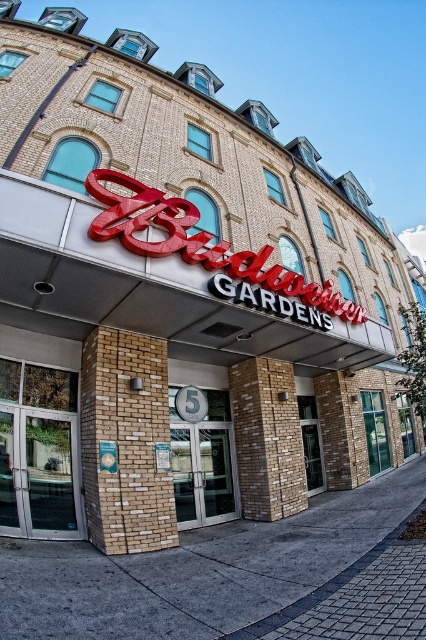
You are a delivery person carrying a package that requires a door 2.5 meters wide. You arrive at the Budweiser Gardens and see the clear glass door at center and the silver metallic doors at center. Which door should you use to ensure your package can fit through?

The clear glass door at center and silver metallic doors at center are 2.22 meters apart from each other. Neither door is wide enough to accommodate a 2.5 meter package, so you cannot use either door.

You are at the entrance of the Budweiser Gardens and want to enter. You see a clear glass door at center and silver metallic doors at center. Which door should you approach first?

The clear glass door at center is closer to the viewer than the silver metallic doors at center, so you should approach the clear glass door at center first to enter.